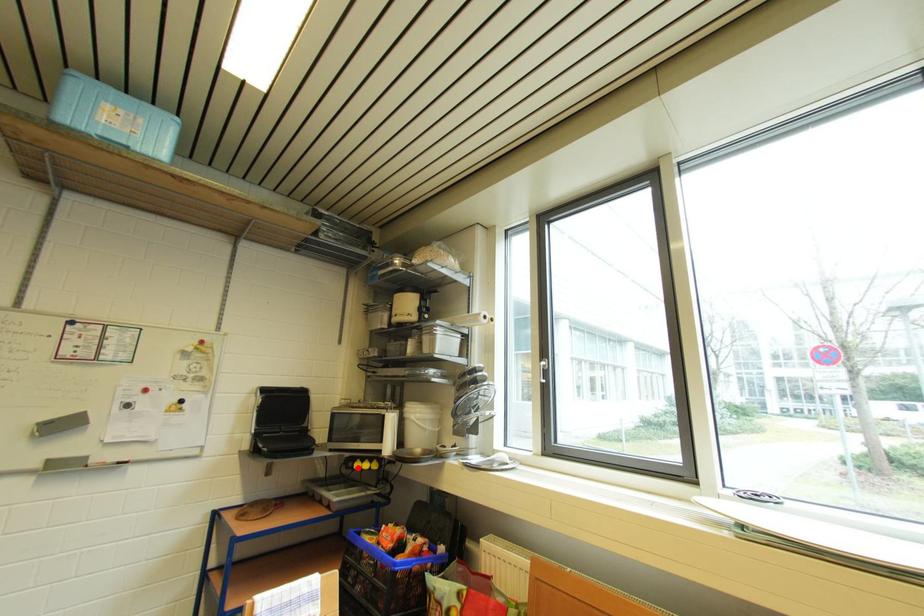
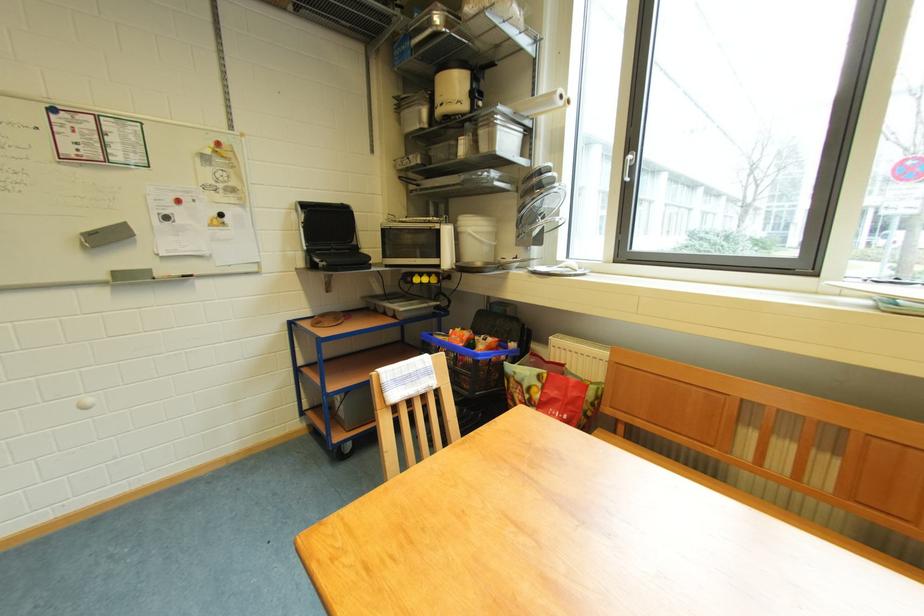
Question: I am providing you with two images of the same scene from different viewpoints. A red point is marked on the first image. Is the red point's position out of view in image 2?

Choices:
 (A) Yes
 (B) No

Answer: (B)